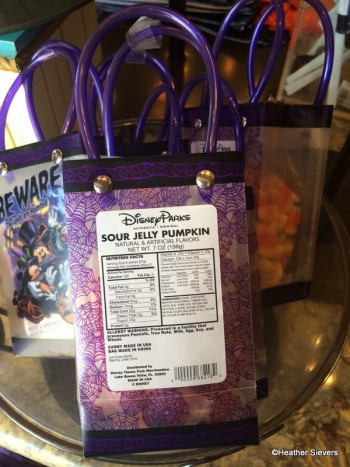
Locate an element on the screen. The height and width of the screenshot is (467, 350). plate is located at coordinates (295, 359).